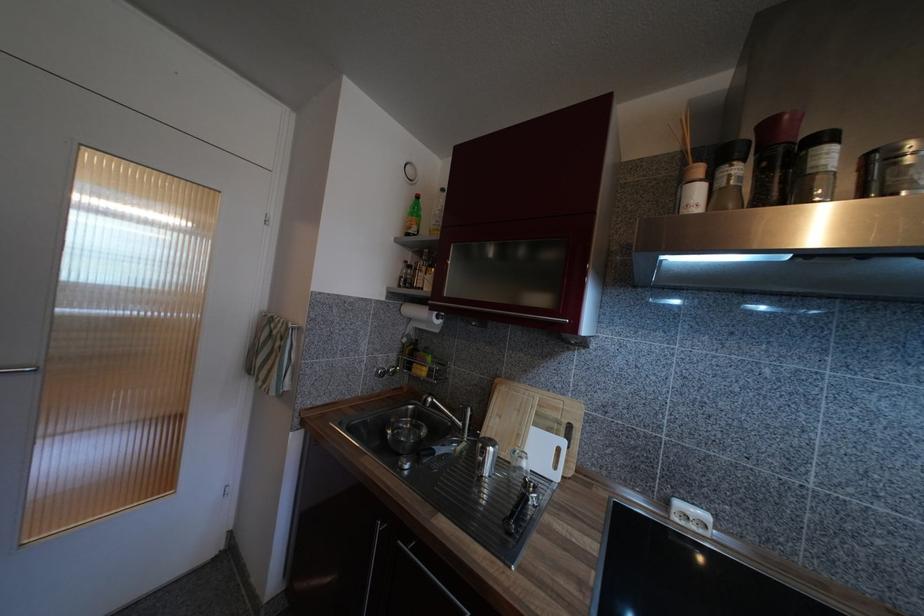
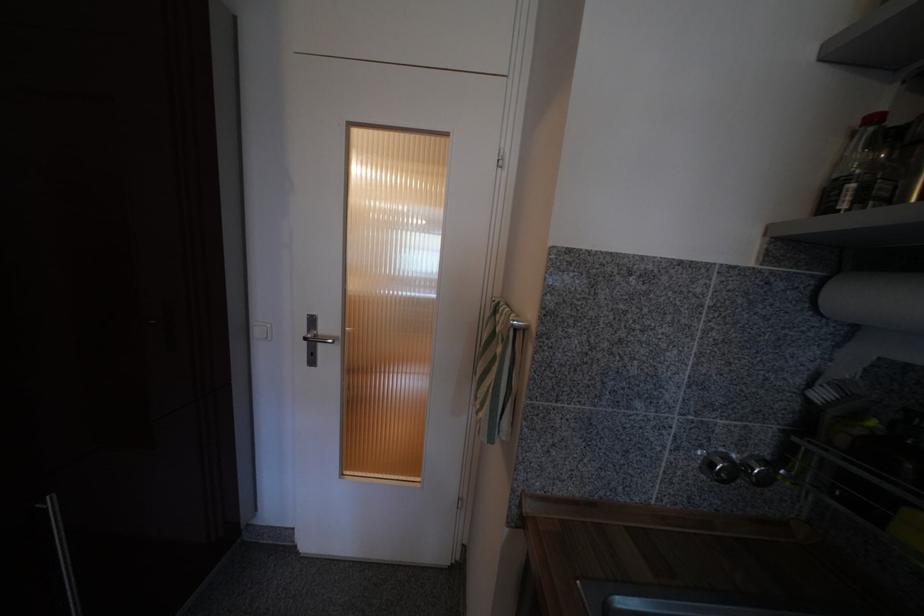
In the second image, find the point that corresponds to point 407,307 in the first image.

(828, 282)